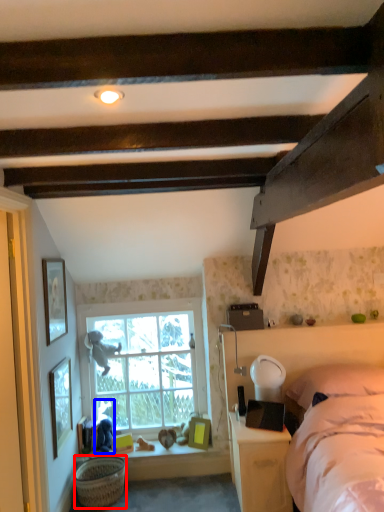
Question: Among these objects, which one is farthest to the camera, basket (highlighted by a red box) or person (highlighted by a blue box)?

Choices:
 (A) basket
 (B) person

Answer: (B)